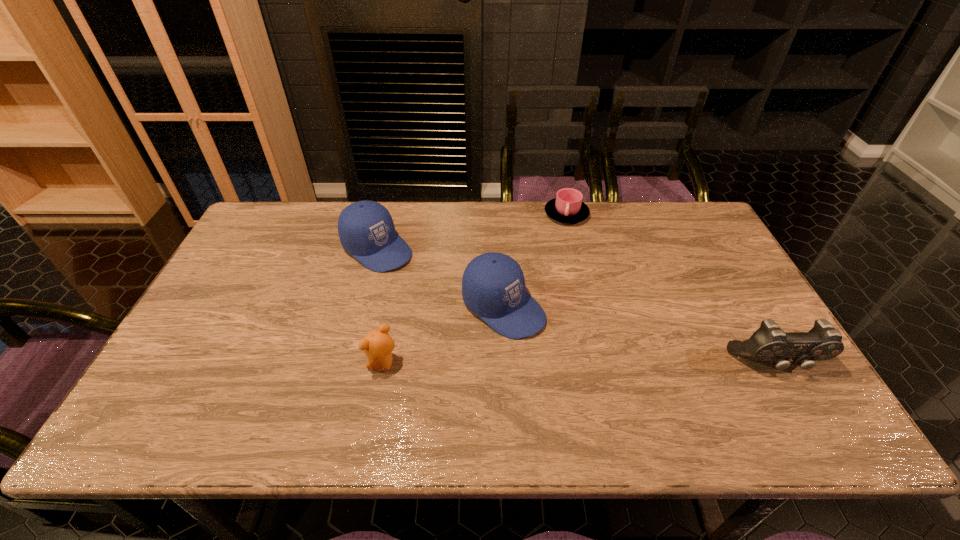
At what (x,y) coordinates should I click in order to perform the action: click on vacant area located on the side with the handle of the shortest object. Please return your answer as a coordinate pair (x, y). This screenshot has height=540, width=960. Looking at the image, I should click on (578, 249).

Locate an element on the screen. The width and height of the screenshot is (960, 540). free space located 0.200m on the side with the handle of the shortest object is located at coordinates (584, 268).

Where is `vacant space situated on the side with the handle of the shortest object`? This screenshot has height=540, width=960. vacant space situated on the side with the handle of the shortest object is located at coordinates (588, 282).

Locate an element on the screen. vacant area situated on the front-facing side of the right cap is located at coordinates (578, 362).

The height and width of the screenshot is (540, 960). Identify the location of free region located on the front-facing side of the right cap. (606, 382).

At what (x,y) coordinates should I click in order to perform the action: click on vacant space positioned 0.150m on the front-facing side of the right cap. Please return your answer as a coordinate pair (x, y). Image resolution: width=960 pixels, height=540 pixels. Looking at the image, I should click on (582, 364).

At what (x,y) coordinates should I click in order to perform the action: click on vacant space located 0.140m on the front-facing side of the farther cap. Please return your answer as a coordinate pair (x, y). Looking at the image, I should click on (431, 288).

At what (x,y) coordinates should I click in order to perform the action: click on free space located 0.240m on the front-facing side of the farther cap. Please return your answer as a coordinate pair (x, y). The image size is (960, 540). Looking at the image, I should click on (455, 306).

The height and width of the screenshot is (540, 960). Identify the location of vacant area located 0.210m on the front-facing side of the farther cap. (448, 300).

At what (x,y) coordinates should I click in order to perform the action: click on cup located at the far edge. Please return your answer as a coordinate pair (x, y). Looking at the image, I should click on (567, 207).